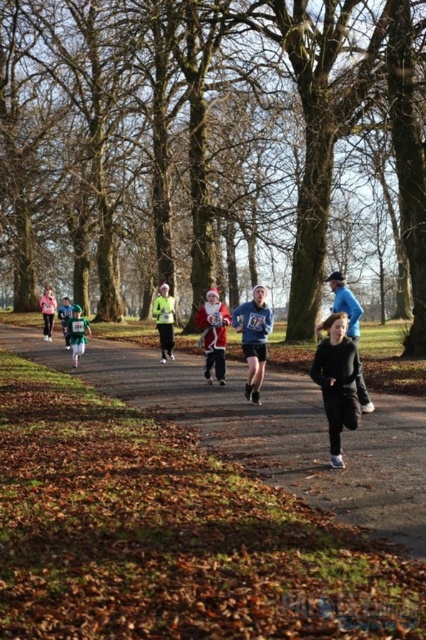
Question: Which object appears farthest from the camera in this image?

Choices:
 (A) black matte running suit at lower right
 (B) matte pink hoodie at center
 (C) black matte jacket at center
 (D) red velvet santa suit at center

Answer: (B)

Question: Which of the following is the closest to the observer?

Choices:
 (A) (173, 388)
 (B) (77, 321)

Answer: (A)

Question: Where is red velvet santa suit at center located in relation to black matte jacket at center in the image?

Choices:
 (A) right
 (B) left

Answer: (B)

Question: Which of these objects is positioned closest to the black matte jacket at center?

Choices:
 (A) green matte jacket at center
 (B) red velvet santa suit at center

Answer: (B)

Question: Does black fabric path at center have a smaller size compared to green jersey at center?

Choices:
 (A) no
 (B) yes

Answer: (A)

Question: Is black fabric path at center bigger than blue fabric shirt at center?

Choices:
 (A) yes
 (B) no

Answer: (A)